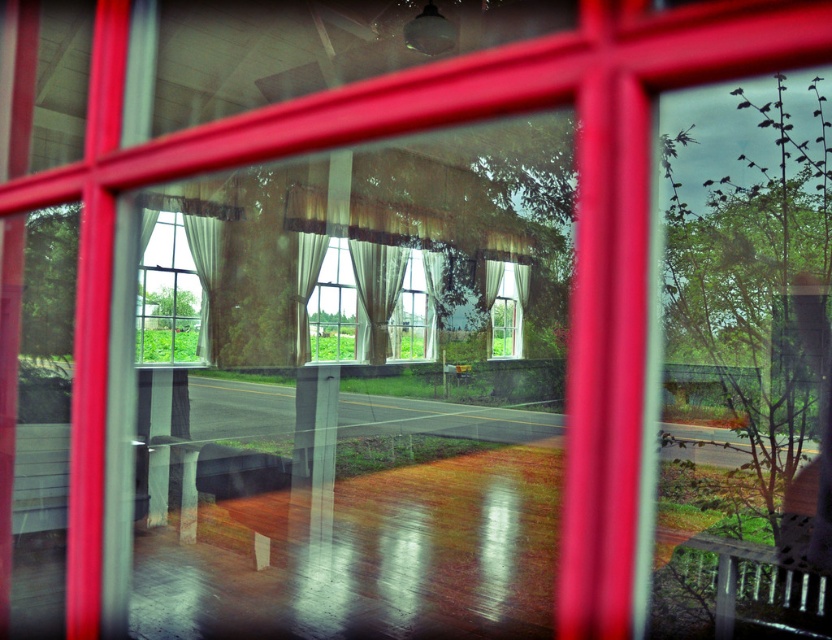
Question: Is sheer white curtain at center below matte glass window at center?

Choices:
 (A) yes
 (B) no

Answer: (B)

Question: Is wooden park bench at lower right to the right of sheer white curtain at center from the viewer's perspective?

Choices:
 (A) no
 (B) yes

Answer: (B)

Question: Can you confirm if wooden park bench at lower right is smaller than white sheer curtain at center?

Choices:
 (A) no
 (B) yes

Answer: (B)

Question: Among these points, which one is nearest to the camera?

Choices:
 (A) (313, 241)
 (B) (162, 305)
 (C) (280, 470)
 (D) (389, 262)

Answer: (C)

Question: Estimate the real-world distances between objects in this image. Which object is closer to the wooden park bench at center?

Choices:
 (A) beige textured curtain at center
 (B) matte glass window at center
 (C) sheer white curtain at center

Answer: (A)

Question: Which point is closer to the camera?

Choices:
 (A) translucent white curtains at center
 (B) matte glass window at center
 (C) white sheer curtain at center

Answer: (A)